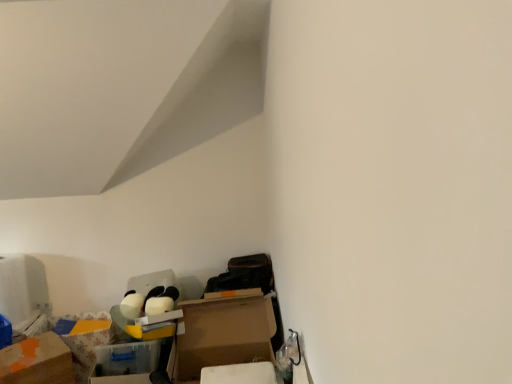
Question: Does translucent plastic storage box at lower left, positioned as the 1th storage box in front-to-back order, appear on the left side of cardboard box at lower left, arranged as the first cardboard box when viewed from the right?

Choices:
 (A) no
 (B) yes

Answer: (B)

Question: Can you confirm if translucent plastic storage box at lower left, the 2th storage box viewed from the left, is shorter than cardboard box at lower left, positioned as the 2th cardboard box in left-to-right order?

Choices:
 (A) no
 (B) yes

Answer: (B)

Question: Would you consider translucent plastic storage box at lower left, positioned as the 1th storage box in front-to-back order, to be distant from cardboard box at lower left, arranged as the first cardboard box when viewed from the right?

Choices:
 (A) yes
 (B) no

Answer: (B)

Question: Is translucent plastic storage box at lower left, the first storage box from the right, turned away from cardboard box at lower left, arranged as the first cardboard box when viewed from the right?

Choices:
 (A) yes
 (B) no

Answer: (B)

Question: Can you confirm if translucent plastic storage box at lower left, the first storage box from the right, is taller than cardboard box at lower left, arranged as the first cardboard box when viewed from the right?

Choices:
 (A) yes
 (B) no

Answer: (B)

Question: Based on their positions, is cardboard box at lower left, positioned as the 2th cardboard box in left-to-right order, located to the left or right of orange matte cardboard box at lower left, the first cardboard box viewed from the left?

Choices:
 (A) left
 (B) right

Answer: (B)

Question: Is point (197, 362) positioned closer to the camera than point (40, 357)?

Choices:
 (A) farther
 (B) closer

Answer: (A)

Question: From a real-world perspective, is cardboard box at lower left, positioned as the 2th cardboard box in left-to-right order, physically located above or below orange matte cardboard box at lower left, which appears as the second cardboard box when viewed from the right?

Choices:
 (A) below
 (B) above

Answer: (B)

Question: Relative to orange matte cardboard box at lower left, the first cardboard box viewed from the left, is cardboard box at lower left, arranged as the first cardboard box when viewed from the right, in front or behind?

Choices:
 (A) behind
 (B) front

Answer: (B)

Question: From a real-world perspective, is floral-patterned cardboard box at lower left, the first storage box viewed from the back, positioned above or below cardboard box at lower left, arranged as the first cardboard box when viewed from the right?

Choices:
 (A) above
 (B) below

Answer: (B)

Question: Is floral-patterned cardboard box at lower left, the first storage box viewed from the back, wider or thinner than cardboard box at lower left, positioned as the 2th cardboard box in left-to-right order?

Choices:
 (A) thin
 (B) wide

Answer: (A)

Question: Is point (105, 316) closer or farther from the camera than point (254, 329)?

Choices:
 (A) farther
 (B) closer

Answer: (A)

Question: Is floral-patterned cardboard box at lower left, the first storage box viewed from the back, inside or outside of cardboard box at lower left, arranged as the first cardboard box when viewed from the right?

Choices:
 (A) outside
 (B) inside

Answer: (A)

Question: Relative to translucent plastic storage box at lower left, which ranks as the 2th storage box in back-to-front order, is cardboard box at lower left, positioned as the 2th cardboard box in left-to-right order, in front or behind?

Choices:
 (A) behind
 (B) front

Answer: (B)

Question: Is cardboard box at lower left, positioned as the 2th cardboard box in left-to-right order, taller or shorter than translucent plastic storage box at lower left, the 2th storage box viewed from the left?

Choices:
 (A) short
 (B) tall

Answer: (B)